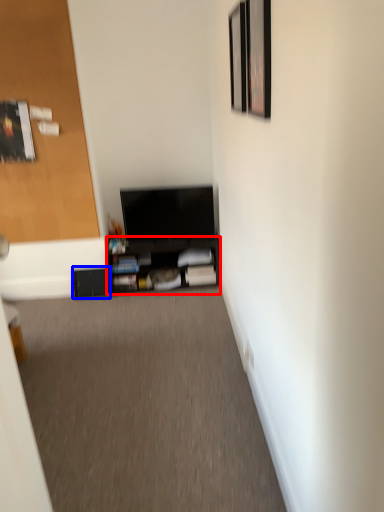
Question: Which of the following is the closest to the observer, shelf (highlighted by a red box) or shelf (highlighted by a blue box)?

Choices:
 (A) shelf
 (B) shelf

Answer: (A)